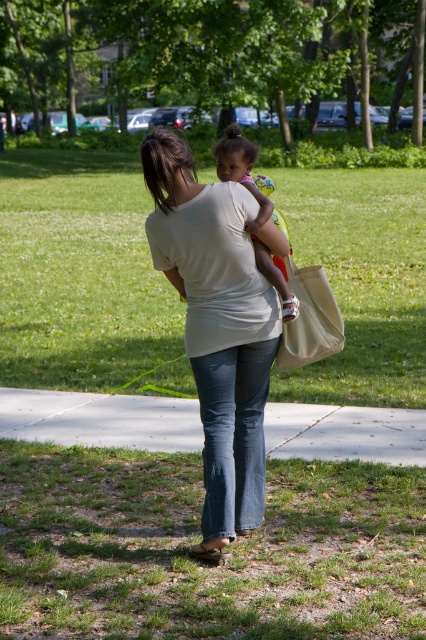
Is point (379, 468) in front of point (222, 440)?

No, (379, 468) is further to viewer.

Can you confirm if green grass at lower center is smaller than denim jeans at center?

Actually, green grass at lower center might be larger than denim jeans at center.

Which is behind, point (232, 588) or point (258, 432)?

Point (258, 432)

You are a GUI agent. You are given a task and a screenshot of the screen. Output one action in this format:
    pyautogui.click(x=<x>, y=<y>)
    Task: Click on the green grass at lower center
    This screenshot has height=640, width=426.
    Given the screenshot: What is the action you would take?
    coord(203,563)

Is green grass at center below denim jeans at center?

Actually, green grass at center is above denim jeans at center.

Does green grass at center have a larger size compared to denim jeans at center?

Yes, green grass at center is bigger than denim jeans at center.

This screenshot has width=426, height=640. What do you see at coordinates (83, 276) in the screenshot?
I see `green grass at center` at bounding box center [83, 276].

Locate an element on the screen. The image size is (426, 640). green grass at center is located at coordinates (83, 276).

Does green grass at center have a greater width compared to white matte shirt at center?

Yes.

Is point (422, 332) less distant than point (255, 284)?

No, it is not.

Does point (34, 276) come closer to viewer compared to point (256, 205)?

That is False.

Image resolution: width=426 pixels, height=640 pixels. In order to click on green grass at center in this screenshot , I will do `click(83, 276)`.